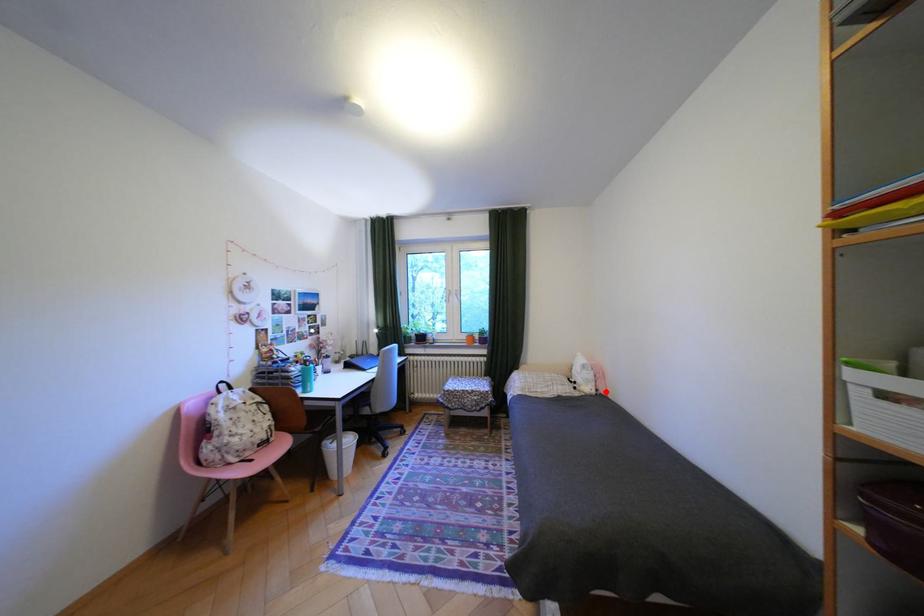
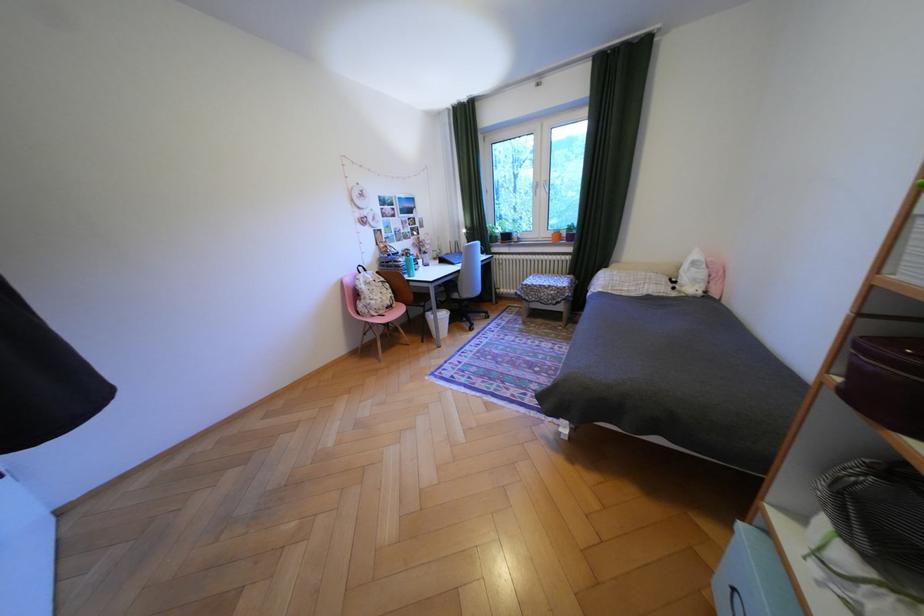
Question: I am providing you with two images of the same scene from different viewpoints. In image1, a red point is highlighted. Considering the same 3D point in image2, which of the following is correct?

Choices:
 (A) It is closer
 (B) It is farther

Answer: (A)